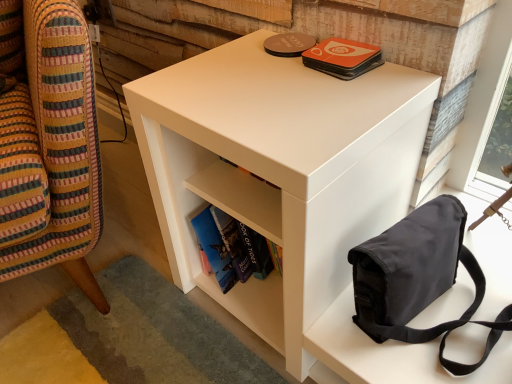
Question: Considering the relative sizes of white matte side table at lower right and white matte bookshelf at center in the image provided, is white matte side table at lower right shorter than white matte bookshelf at center?

Choices:
 (A) yes
 (B) no

Answer: (B)

Question: Is white matte side table at lower right wider than white matte bookshelf at center?

Choices:
 (A) no
 (B) yes

Answer: (B)

Question: From a real-world perspective, is white matte side table at lower right located higher than white matte bookshelf at center?

Choices:
 (A) yes
 (B) no

Answer: (A)

Question: Does white matte side table at lower right have a smaller size compared to white matte bookshelf at center?

Choices:
 (A) yes
 (B) no

Answer: (B)

Question: Considering the relative sizes of white matte side table at lower right and white matte bookshelf at center in the image provided, is white matte side table at lower right thinner than white matte bookshelf at center?

Choices:
 (A) no
 (B) yes

Answer: (A)

Question: Does point (57, 215) appear closer or farther from the camera than point (348, 249)?

Choices:
 (A) closer
 (B) farther

Answer: (B)

Question: From their relative heights in the image, would you say white matte side table at lower right is taller or shorter than white matte nightstand at center?

Choices:
 (A) short
 (B) tall

Answer: (B)

Question: From a real-world perspective, is white matte side table at lower right physically located above or below white matte nightstand at center?

Choices:
 (A) above
 (B) below

Answer: (A)

Question: Is white matte side table at lower right bigger or smaller than white matte nightstand at center?

Choices:
 (A) small
 (B) big

Answer: (B)

Question: Considering the positions of white matte nightstand at center and white matte bookshelf at center in the image, is white matte nightstand at center wider or thinner than white matte bookshelf at center?

Choices:
 (A) thin
 (B) wide

Answer: (B)

Question: From a real-world perspective, is white matte nightstand at center above or below white matte bookshelf at center?

Choices:
 (A) below
 (B) above

Answer: (A)

Question: Is white matte nightstand at center taller or shorter than white matte bookshelf at center?

Choices:
 (A) tall
 (B) short

Answer: (B)

Question: Relative to white matte bookshelf at center, is white matte nightstand at center in front or behind?

Choices:
 (A) front
 (B) behind

Answer: (A)

Question: From the image's perspective, is white matte nightstand at center positioned above or below black canvas bag at upper right?

Choices:
 (A) above
 (B) below

Answer: (B)

Question: Is white matte nightstand at center taller or shorter than black canvas bag at upper right?

Choices:
 (A) tall
 (B) short

Answer: (B)